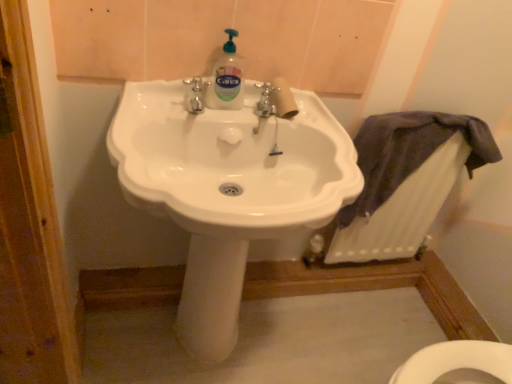
The image size is (512, 384). In order to click on vacant area located to the right-hand side of translucent plastic bottle at center in this screenshot , I will do 271,117.